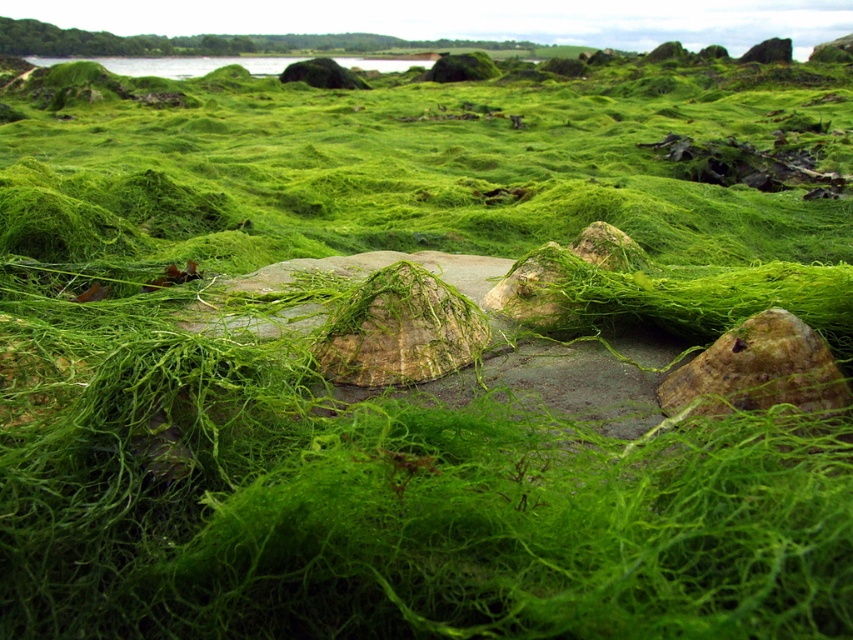
Question: Which of the following is the farthest from the observer?

Choices:
 (A) (245, 58)
 (B) (718, 384)

Answer: (A)

Question: From the image, what is the correct spatial relationship of brown textured stone at center in relation to green mossy water at upper center?

Choices:
 (A) left
 (B) right

Answer: (B)

Question: Which point is closer to the camera?

Choices:
 (A) (762, 387)
 (B) (129, 65)

Answer: (A)

Question: Is brown textured stone at center bigger than green mossy water at upper center?

Choices:
 (A) yes
 (B) no

Answer: (B)

Question: Is brown textured stone at center to the right of green mossy water at upper center from the viewer's perspective?

Choices:
 (A) no
 (B) yes

Answer: (B)